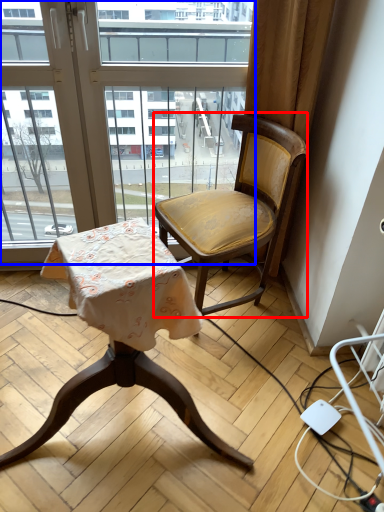
Question: Which object appears farthest to the camera in this image, chair (highlighted by a red box) or window (highlighted by a blue box)?

Choices:
 (A) chair
 (B) window

Answer: (B)